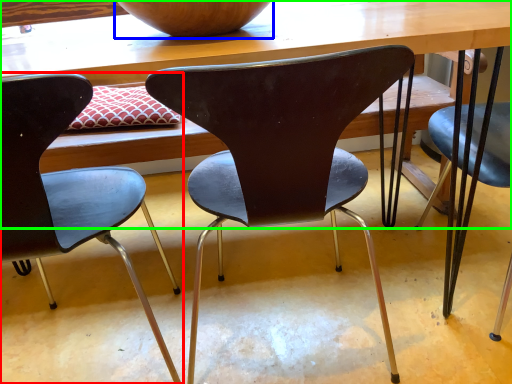
Question: Which object is the farthest from chair (highlighted by a red box)? Choose among these: bowl (highlighted by a blue box) or table (highlighted by a green box).

Choices:
 (A) bowl
 (B) table

Answer: (A)